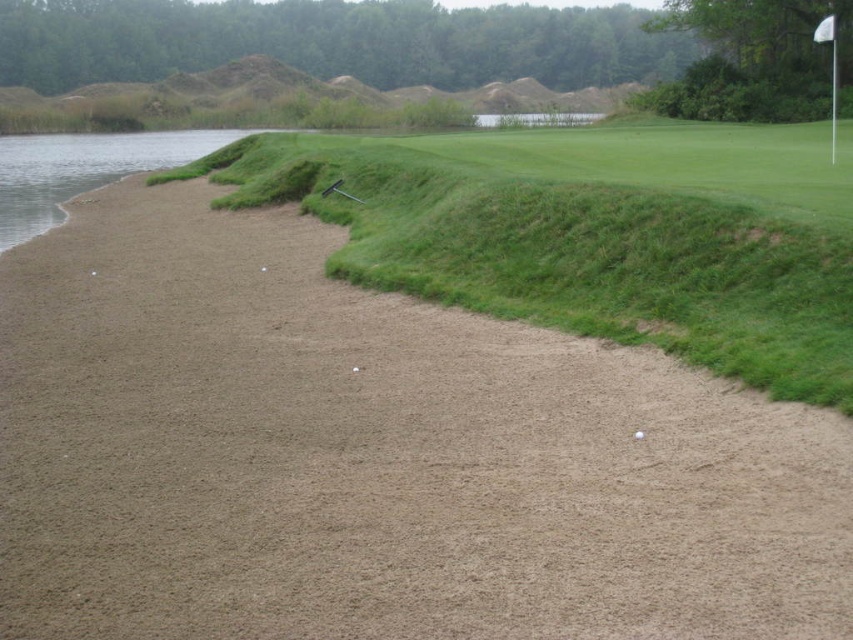
You are a golfer standing at the tee and want to hit your ball to the green grass at center. Based on the coordinates provided in the Objects Description, can you determine the direction you should aim relative to the sand trap and water hazard?

The green grass at center is located at point (593, 236), which means it is positioned to the right and slightly forward of the sand trap and water hazard. You should aim towards the right side of the sand trap and beyond the water hazard to reach the green grass at center.